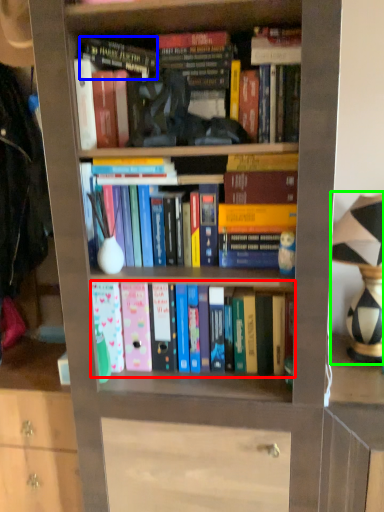
Question: Which is nearer to the book (highlighted by a red box)? book (highlighted by a blue box) or table lamp (highlighted by a green box).

Choices:
 (A) book
 (B) table lamp

Answer: (B)